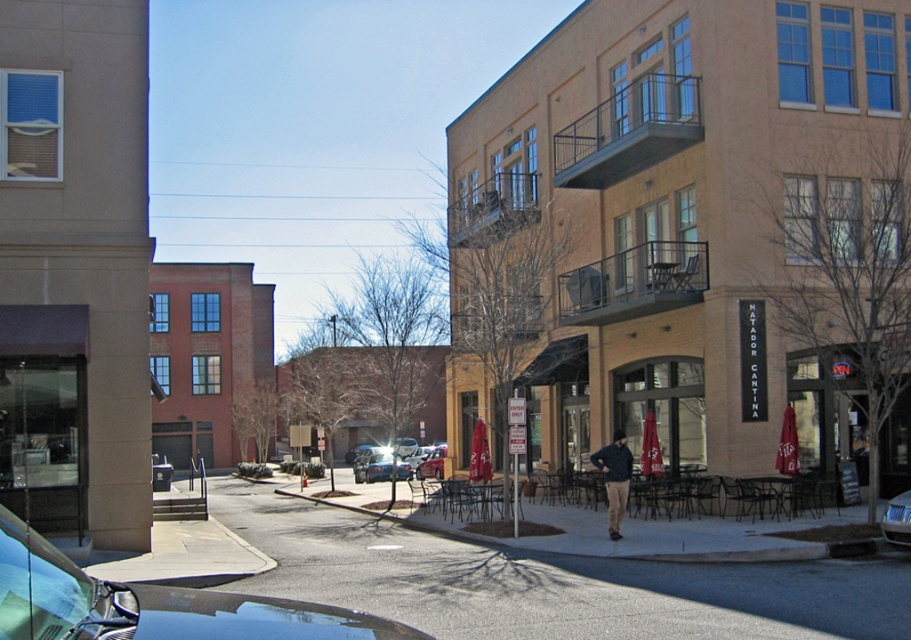
Question: Which object is positioned farthest from the metallic silver sedan at center?

Choices:
 (A) gray asphalt at center
 (B) shiny blue car at lower left
 (C) metallic blue sedan at lower right

Answer: (C)

Question: Among these points, which one is farthest from the camera?

Choices:
 (A) (180, 618)
 (B) (395, 472)

Answer: (B)

Question: Based on their relative distances, which object is nearer to the metallic blue sedan at lower right?

Choices:
 (A) gray asphalt at center
 (B) shiny blue car at lower left

Answer: (A)

Question: Does gray asphalt at center have a lesser width compared to metallic silver sedan at center?

Choices:
 (A) yes
 (B) no

Answer: (B)

Question: Is shiny blue car at lower left to the left of metallic silver sedan at center from the viewer's perspective?

Choices:
 (A) no
 (B) yes

Answer: (A)

Question: Is metallic silver sedan at center positioned in front of metallic blue sedan at lower right?

Choices:
 (A) no
 (B) yes

Answer: (A)